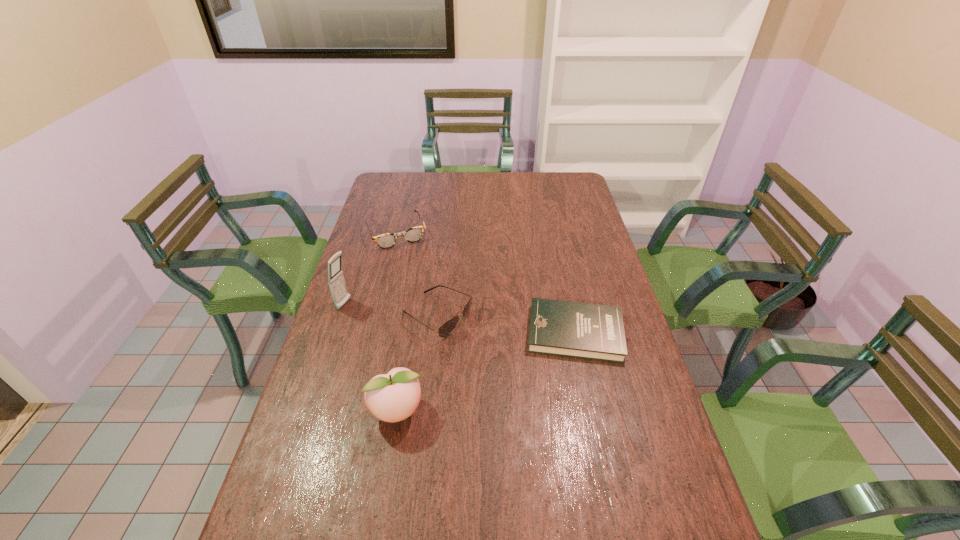
Where is `vacant area located 0.110m on the front-facing side of the sunglasses`? This screenshot has height=540, width=960. vacant area located 0.110m on the front-facing side of the sunglasses is located at coordinates (496, 346).

Identify the location of vacant space located on the front-facing side of the sunglasses. Image resolution: width=960 pixels, height=540 pixels. (532, 365).

The image size is (960, 540). Find the location of `free spot located 0.290m on the front-facing side of the tallest object`. free spot located 0.290m on the front-facing side of the tallest object is located at coordinates (429, 336).

Locate an element on the screen. The height and width of the screenshot is (540, 960). free space located on the front-facing side of the tallest object is located at coordinates (423, 334).

Image resolution: width=960 pixels, height=540 pixels. Find the location of `free spot located 0.200m on the front-facing side of the tallest object`. free spot located 0.200m on the front-facing side of the tallest object is located at coordinates (403, 326).

You are a GUI agent. You are given a task and a screenshot of the screen. Output one action in this format:
    pyautogui.click(x=<x>, y=<y>)
    Task: Click on the vacant space located 0.250m on the frame of the farthest object
    
    Given the screenshot: What is the action you would take?
    pyautogui.click(x=425, y=292)

At what (x,y) coordinates should I click in order to perform the action: click on vacant space located 0.180m on the frame of the farthest object. Please return your answer as a coordinate pair (x, y). Looking at the image, I should click on (419, 279).

Identify the location of vacant space located on the frame of the farthest object. This screenshot has height=540, width=960. tap(420, 280).

At what (x,y) coordinates should I click in order to perform the action: click on cellular telephone that is at the left edge. Please return your answer as a coordinate pair (x, y). The width and height of the screenshot is (960, 540). Looking at the image, I should click on (336, 281).

Locate an element on the screen. This screenshot has width=960, height=540. spectacles situated at the left edge is located at coordinates (414, 234).